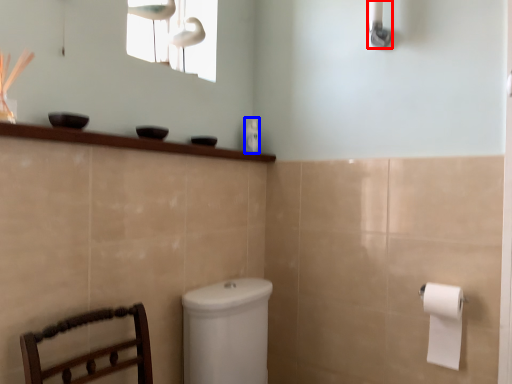
Question: Which point is further to the camera, shower (highlighted by a red box) or toiletry (highlighted by a blue box)?

Choices:
 (A) shower
 (B) toiletry

Answer: (B)